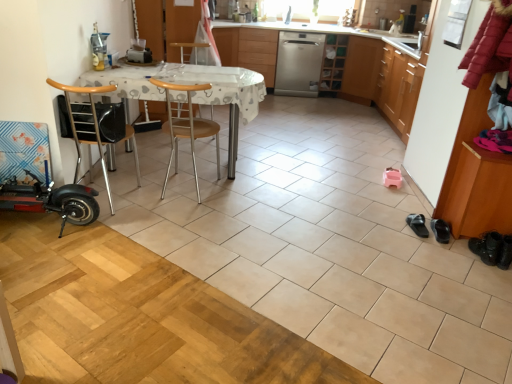
Find the location of a particular element. The image size is (512, 384). free space in front of black leather boots at lower right, the 1th footwear in the right-to-left sequence is located at coordinates (494, 273).